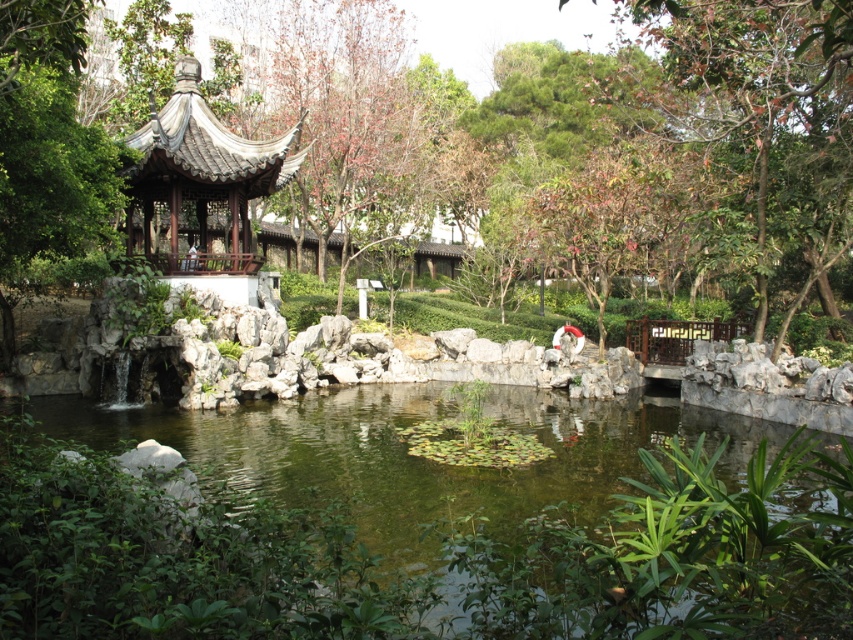
From the picture: How distant is green leafy tree at center from brown wood tree at upper center?

12.01 feet

The height and width of the screenshot is (640, 853). In order to click on green leafy tree at center in this screenshot , I will do `click(595, 148)`.

Measure the distance between point (x=512, y=61) and camera.

The distance of point (x=512, y=61) from camera is 51.03 meters.

The image size is (853, 640). Identify the location of green leafy tree at center. (595, 148).

Which is behind, point (782, 134) or point (354, 131)?

The point (354, 131) is behind.

Find the location of a particular element. The width and height of the screenshot is (853, 640). brown wood tree at upper right is located at coordinates (757, 129).

This screenshot has width=853, height=640. Find the location of `brown wood tree at upper right`. brown wood tree at upper right is located at coordinates (757, 129).

Is green leafy pond at center below matte gray gazebo at center-left?

Yes.

Is point (212, 486) more distant than point (268, 177)?

No, (212, 486) is closer to viewer.

Image resolution: width=853 pixels, height=640 pixels. What are the coordinates of `green leafy pond at center` in the screenshot? It's located at (422, 554).